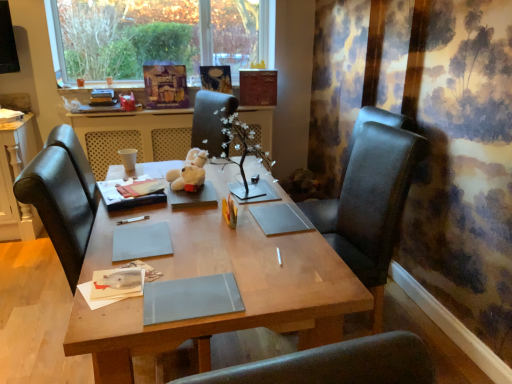
Question: From the image's perspective, would you say matte gray notebook at center, the 2th notebook positioned from the back, is shown under white plush bear at center?

Choices:
 (A) no
 (B) yes

Answer: (B)

Question: Is matte gray notebook at center, positioned as the second notebook in left-to-right order, thinner than white plush bear at center?

Choices:
 (A) no
 (B) yes

Answer: (A)

Question: Does matte gray notebook at center, which is the 1th notebook in right-to-left order, have a larger size compared to white plush bear at center?

Choices:
 (A) no
 (B) yes

Answer: (A)

Question: From a real-world perspective, is matte gray notebook at center, which is the 1th notebook in right-to-left order, physically below white plush bear at center?

Choices:
 (A) yes
 (B) no

Answer: (A)

Question: Considering the relative positions of matte gray notebook at center, the 2th notebook positioned from the back, and white plush bear at center in the image provided, is matte gray notebook at center, the 2th notebook positioned from the back, to the left of white plush bear at center from the viewer's perspective?

Choices:
 (A) no
 (B) yes

Answer: (A)

Question: Is wooden desk at center in front of or behind white plush bear at center in the image?

Choices:
 (A) front
 (B) behind

Answer: (A)

Question: From the image's perspective, is wooden desk at center positioned above or below white plush bear at center?

Choices:
 (A) above
 (B) below

Answer: (B)

Question: Is wooden desk at center taller or shorter than white plush bear at center?

Choices:
 (A) short
 (B) tall

Answer: (B)

Question: Considering the positions of wooden desk at center and white plush bear at center in the image, is wooden desk at center wider or thinner than white plush bear at center?

Choices:
 (A) thin
 (B) wide

Answer: (B)

Question: Would you say wooden desk at center is to the left or to the right of matte gray notebook at center, placed as the first notebook when sorted from front to back, in the picture?

Choices:
 (A) left
 (B) right

Answer: (A)

Question: Is wooden desk at center bigger or smaller than matte gray notebook at center, positioned as the second notebook in left-to-right order?

Choices:
 (A) small
 (B) big

Answer: (B)

Question: From a real-world perspective, relative to matte gray notebook at center, the 2th notebook positioned from the back, is wooden desk at center vertically above or below?

Choices:
 (A) above
 (B) below

Answer: (B)

Question: Do you think wooden desk at center is within matte gray notebook at center, placed as the first notebook when sorted from front to back, or outside of it?

Choices:
 (A) inside
 (B) outside

Answer: (B)

Question: Visually, is white plush bear at center positioned to the left or to the right of black leather chair at right?

Choices:
 (A) right
 (B) left

Answer: (B)

Question: From their relative heights in the image, would you say white plush bear at center is taller or shorter than black leather chair at right?

Choices:
 (A) short
 (B) tall

Answer: (A)